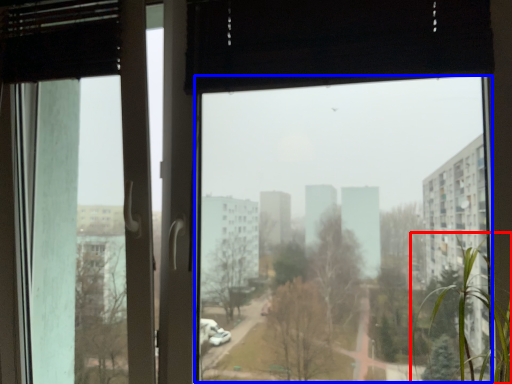
Question: Among these objects, which one is farthest to the camera, tree (highlighted by a red box) or window screen (highlighted by a blue box)?

Choices:
 (A) tree
 (B) window screen

Answer: (B)